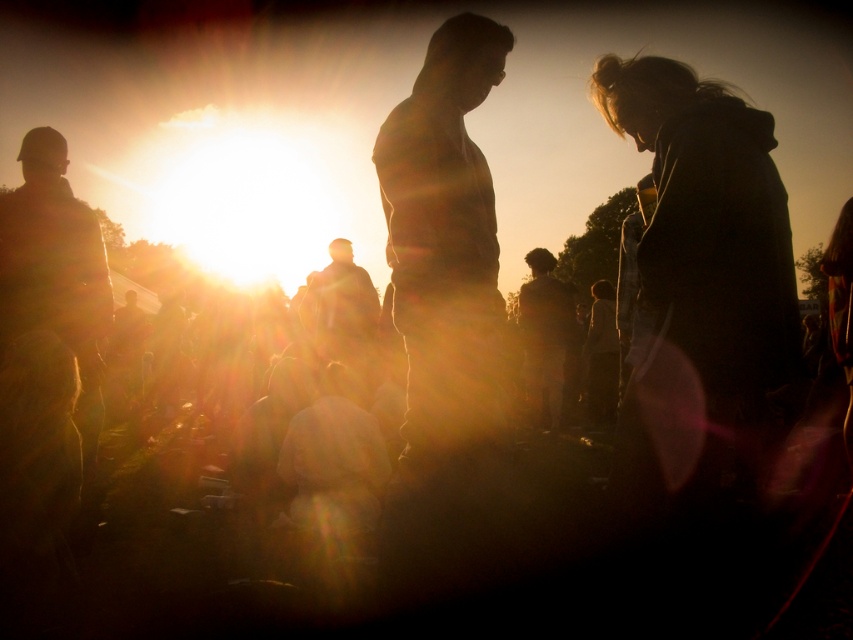
Question: Which point is closer to the camera?

Choices:
 (A) silhouette figure at center
 (B) dark hair at center
 (C) dark gray hoodie at right

Answer: (C)

Question: Does silhouette figure at center have a smaller size compared to dark hair at center?

Choices:
 (A) yes
 (B) no

Answer: (A)

Question: Which object is closer to the camera taking this photo?

Choices:
 (A) silhouette figure at center
 (B) dark gray hoodie at right

Answer: (B)

Question: Can you confirm if silhouette figure at center is positioned to the right of dark hair at center?

Choices:
 (A) no
 (B) yes

Answer: (A)

Question: Is dark gray hoodie at right thinner than dark hair at center?

Choices:
 (A) no
 (B) yes

Answer: (A)

Question: Which object is farther from the camera taking this photo?

Choices:
 (A) dark gray hoodie at right
 (B) silhouette figure at center

Answer: (B)